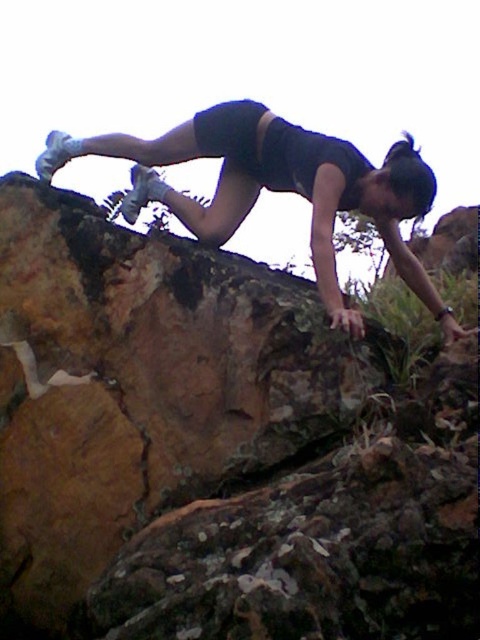
Question: Can you confirm if brown rough rock at upper left is thinner than matte black shorts at upper center?

Choices:
 (A) yes
 (B) no

Answer: (B)

Question: Which of the following is the farthest from the observer?

Choices:
 (A) brown rough rock at upper left
 (B) matte black shorts at upper center

Answer: (B)

Question: Does brown rough rock at upper left have a lesser width compared to matte black shorts at upper center?

Choices:
 (A) yes
 (B) no

Answer: (B)

Question: Does brown rough rock at upper left have a lesser width compared to matte black shorts at upper center?

Choices:
 (A) no
 (B) yes

Answer: (A)